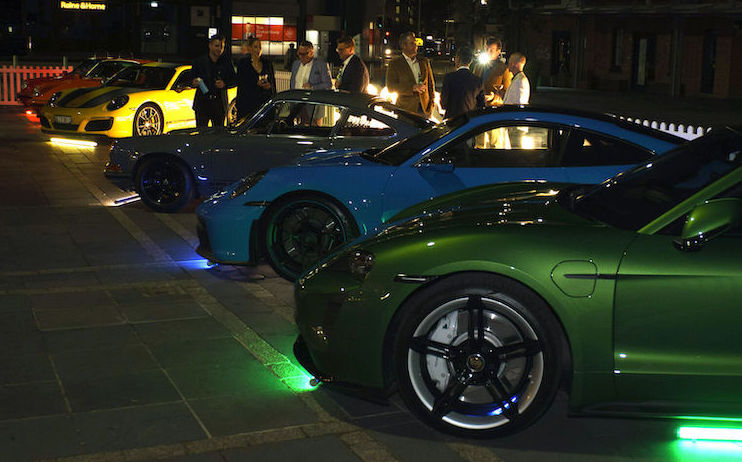
Locate an element on the screen. This screenshot has width=742, height=462. neon sign is located at coordinates (91, 6).